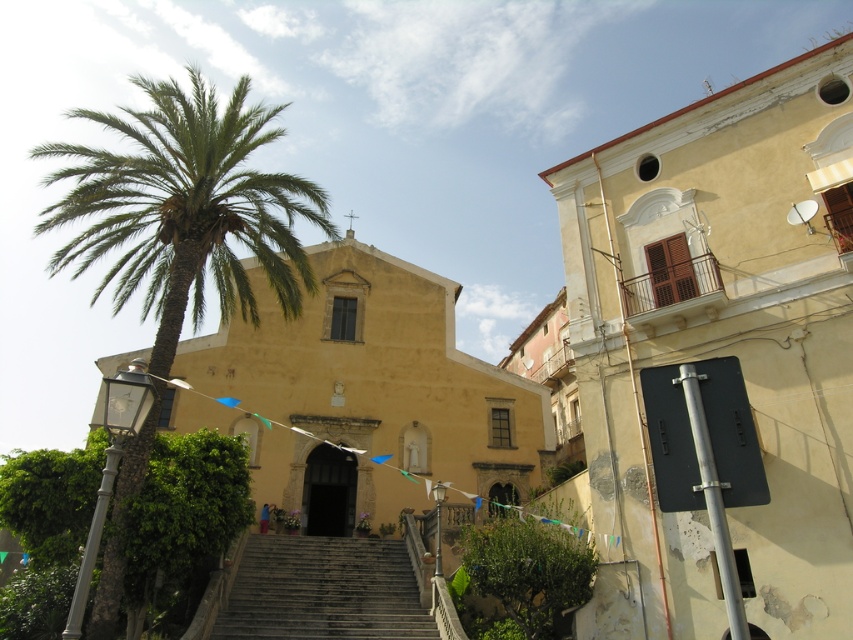
You are an architect designing a new park layout. You need to place a bench between the yellow matte building at upper right and the green leafy palm at left. Which side of the bench should face the narrower object to ensure proper alignment?

The yellow matte building at upper right has a smaller width compared to the green leafy palm at left. Therefore, the bench should face the yellow matte building at upper right to align with its narrower width.

You are an architect analyzing the spatial layout of the scene. You need to determine if the yellow matte building at upper right can be replaced with a new structure that is the same width as the dark gray stone stairs at center. Based on their current widths, would this replacement be feasible?

The yellow matte building at upper right might be wider than dark gray stone stairs at center, so replacing it with a structure the same width as the stairs could be possible if the new structure is narrower than or equal to the stairs width. However, since the exact width difference isn